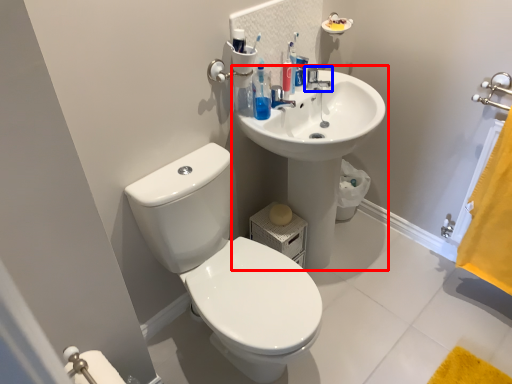
Question: Which object is closer to the camera taking this photo, sink (highlighted by a red box) or tap (highlighted by a blue box)?

Choices:
 (A) sink
 (B) tap

Answer: (A)